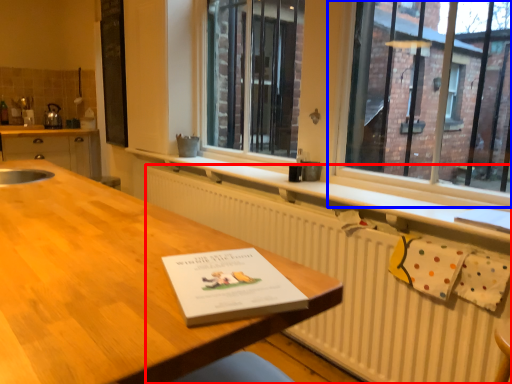
Question: Which object appears farthest to the camera in this image, radiator (highlighted by a red box) or window (highlighted by a blue box)?

Choices:
 (A) radiator
 (B) window

Answer: (B)